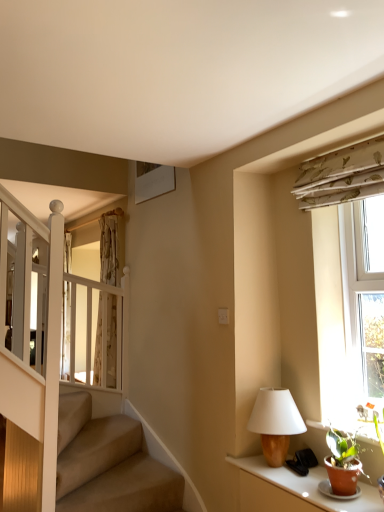
Question: Considering the positions of white textured window at right and wooden table lamp at right in the image, is white textured window at right bigger or smaller than wooden table lamp at right?

Choices:
 (A) small
 (B) big

Answer: (B)

Question: From the image's perspective, is white textured window at right located above or below wooden table lamp at right?

Choices:
 (A) above
 (B) below

Answer: (A)

Question: Which is nearer to the matte brown table at lower right?

Choices:
 (A) floral fabric curtain at upper right
 (B) white textured window at right
 (C) wooden table lamp at right
 (D) translucent fabric curtain at upper left

Answer: (C)

Question: Considering the real-world distances, which object is farthest from the floral fabric curtain at upper right?

Choices:
 (A) wooden table lamp at right
 (B) translucent fabric curtain at upper left
 (C) matte brown table at lower right
 (D) white textured window at right

Answer: (B)